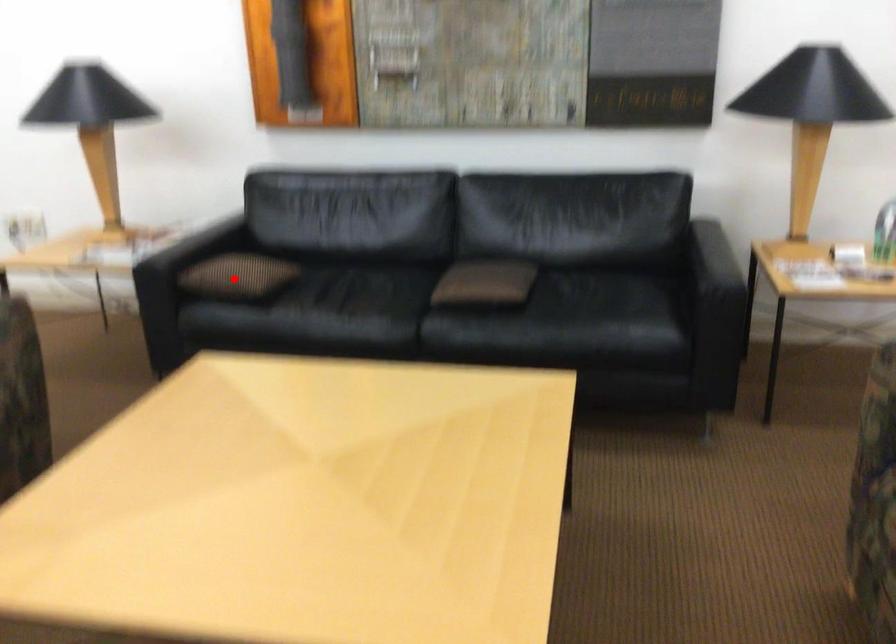
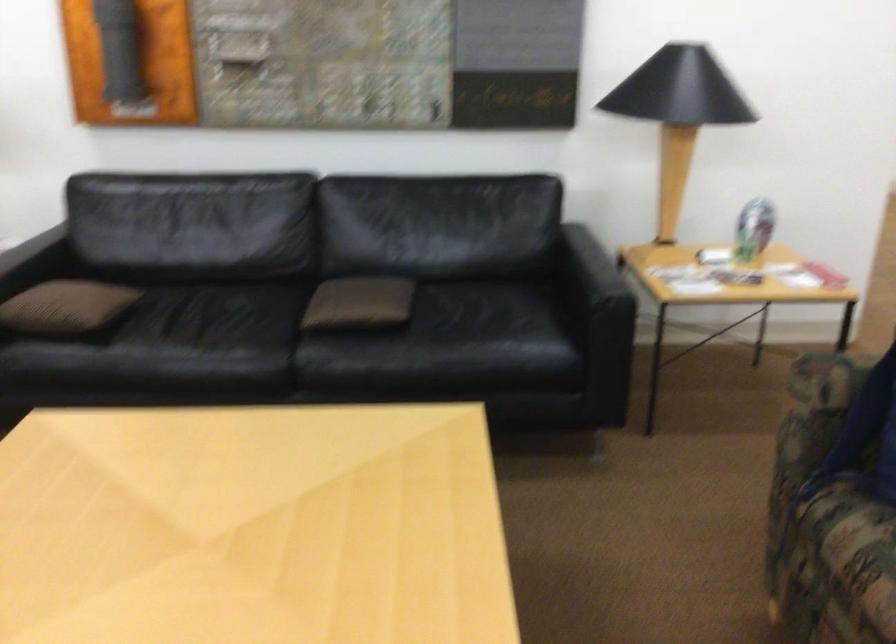
Where in the second image is the point corresponding to the highlighted location from the first image?

(65, 308)